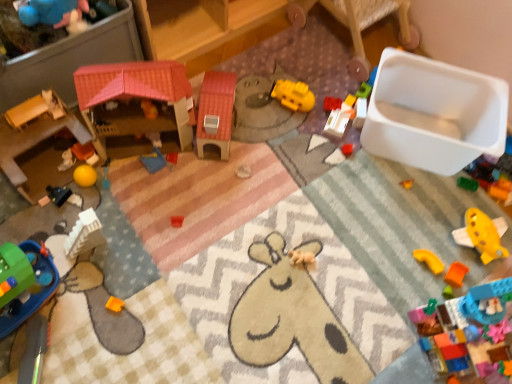
Where is `free space in front of yellow plastic block at upper center, the fifth toy from the right`? free space in front of yellow plastic block at upper center, the fifth toy from the right is located at coordinates (336, 145).